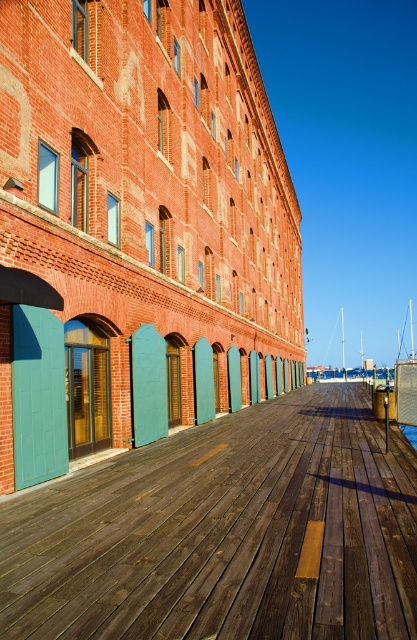
Does wooden dock at center have a greater height compared to white sailboat at center?

In fact, wooden dock at center may be shorter than white sailboat at center.

How far apart are wooden dock at center and white sailboat at center?

wooden dock at center and white sailboat at center are 97.77 meters apart from each other.

Between point (188, 524) and point (343, 362), which one is positioned behind?

Point (343, 362)

You are a GUI agent. You are given a task and a screenshot of the screen. Output one action in this format:
    pyautogui.click(x=<x>, y=<y>)
    Task: Click on the wooden dock at center
    The width and height of the screenshot is (417, 640).
    Given the screenshot: What is the action you would take?
    pyautogui.click(x=225, y=532)

Does point (381, 499) come closer to viewer compared to point (416, 449)?

Yes.

Does wooden dock at center have a greater width compared to blue water at lower center?

Yes.

Is point (369, 609) positioned before point (414, 429)?

Yes, it is in front of point (414, 429).

Find the location of a particular element. This screenshot has width=417, height=640. wooden dock at center is located at coordinates (225, 532).

Can you confirm if white sailboat at center is positioned below blue water at lower center?

Indeed, white sailboat at center is positioned under blue water at lower center.

Which of these two, white sailboat at center or blue water at lower center, stands shorter?

blue water at lower center

Which is behind, point (344, 371) or point (414, 426)?

Point (344, 371)

At what (x,y) coordinates should I click in order to perform the action: click on white sailboat at center. Please return your answer as a coordinate pair (x, y). Looking at the image, I should click on (343, 342).